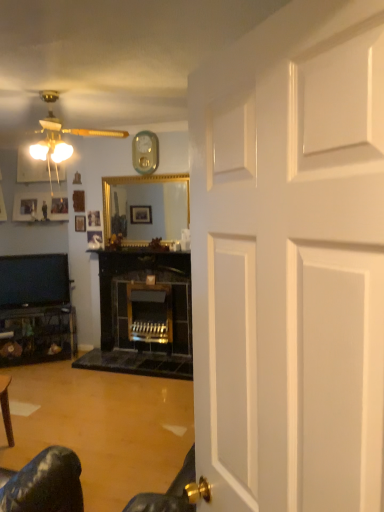
Question: From a real-world perspective, is matte black tv at left on top of matte white ceiling fan at upper left?

Choices:
 (A) no
 (B) yes

Answer: (A)

Question: Could matte white ceiling fan at upper left be considered to be inside matte black tv at left?

Choices:
 (A) yes
 (B) no

Answer: (B)

Question: Would you consider matte black tv at left to be distant from matte white ceiling fan at upper left?

Choices:
 (A) yes
 (B) no

Answer: (A)

Question: Is the depth of matte black tv at left less than that of matte white ceiling fan at upper left?

Choices:
 (A) yes
 (B) no

Answer: (B)

Question: Considering the relative sizes of matte black tv at left and matte white ceiling fan at upper left in the image provided, is matte black tv at left wider than matte white ceiling fan at upper left?

Choices:
 (A) yes
 (B) no

Answer: (B)

Question: Could you tell me if matte black tv at left is turned towards matte white ceiling fan at upper left?

Choices:
 (A) no
 (B) yes

Answer: (A)

Question: Does metallic silver clock at upper center have a greater width compared to wooden picture frame at center, which is counted as the 1th picture frame, starting from the right?

Choices:
 (A) no
 (B) yes

Answer: (A)

Question: Does metallic silver clock at upper center turn towards wooden picture frame at center, arranged as the fourth picture frame when viewed from the back?

Choices:
 (A) yes
 (B) no

Answer: (B)

Question: From the image's perspective, is metallic silver clock at upper center on wooden picture frame at center, which is counted as the 1th picture frame, starting from the right?

Choices:
 (A) no
 (B) yes

Answer: (B)

Question: Does metallic silver clock at upper center come behind wooden picture frame at center, the fourth picture frame positioned from the left?

Choices:
 (A) yes
 (B) no

Answer: (B)

Question: Is metallic silver clock at upper center looking in the opposite direction of wooden picture frame at center, which is counted as the 1th picture frame, starting from the right?

Choices:
 (A) yes
 (B) no

Answer: (B)

Question: Is the depth of metallic silver clock at upper center less than that of wooden picture frame at center, the fourth picture frame positioned from the left?

Choices:
 (A) no
 (B) yes

Answer: (B)

Question: Considering the relative sizes of metallic silver clock at upper center and matte black tv at left in the image provided, is metallic silver clock at upper center smaller than matte black tv at left?

Choices:
 (A) no
 (B) yes

Answer: (B)